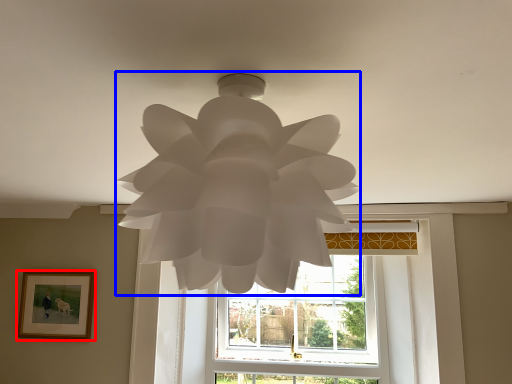
Question: Which object is further to the camera taking this photo, picture frame (highlighted by a red box) or lamp (highlighted by a blue box)?

Choices:
 (A) picture frame
 (B) lamp

Answer: (A)